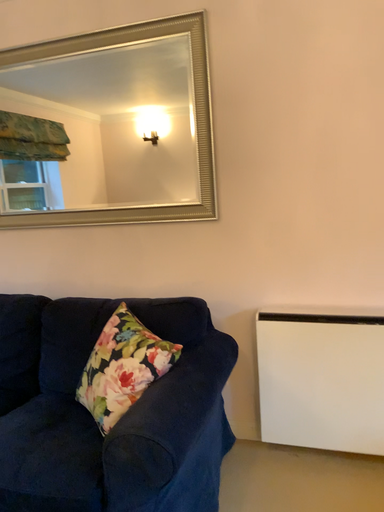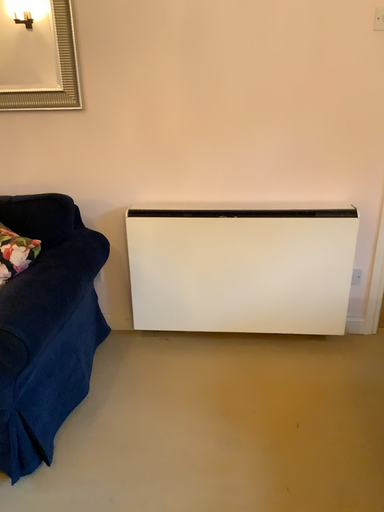
Question: How did the camera likely rotate when shooting the video?

Choices:
 (A) rotated upward
 (B) rotated downward

Answer: (B)